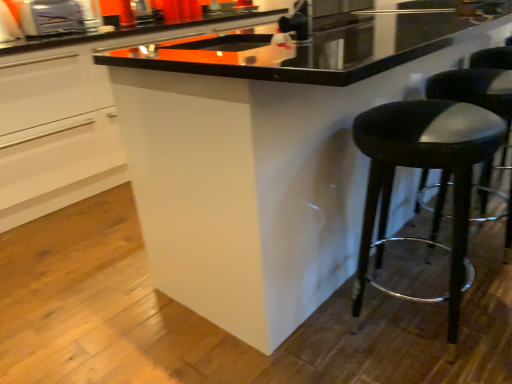
Question: Should I look upward or downward to see black leather stool at lower right?

Choices:
 (A) up
 (B) down

Answer: (B)

Question: Is white glossy cabinet at center wider than black leather stool at right?

Choices:
 (A) no
 (B) yes

Answer: (B)

Question: Are white glossy cabinet at center and black leather stool at right beside each other?

Choices:
 (A) yes
 (B) no

Answer: (B)

Question: From a real-world perspective, is white glossy cabinet at center over black leather stool at right?

Choices:
 (A) no
 (B) yes

Answer: (B)

Question: From a real-world perspective, is white glossy cabinet at center located beneath black leather stool at right?

Choices:
 (A) yes
 (B) no

Answer: (B)

Question: Considering the relative sizes of white glossy cabinet at center and black leather stool at right in the image provided, is white glossy cabinet at center shorter than black leather stool at right?

Choices:
 (A) no
 (B) yes

Answer: (A)

Question: Considering the relative sizes of white glossy cabinet at center and black leather stool at right in the image provided, is white glossy cabinet at center bigger than black leather stool at right?

Choices:
 (A) yes
 (B) no

Answer: (A)

Question: Considering the relative sizes of metallic silver toaster at upper left and black leather stool at right in the image provided, is metallic silver toaster at upper left shorter than black leather stool at right?

Choices:
 (A) no
 (B) yes

Answer: (B)

Question: From the image's perspective, is metallic silver toaster at upper left on top of black leather stool at right?

Choices:
 (A) yes
 (B) no

Answer: (A)

Question: Can you confirm if metallic silver toaster at upper left is smaller than black leather stool at right?

Choices:
 (A) yes
 (B) no

Answer: (A)

Question: Can you confirm if metallic silver toaster at upper left is positioned to the left of black leather stool at right?

Choices:
 (A) no
 (B) yes

Answer: (B)

Question: Is metallic silver toaster at upper left positioned behind black leather stool at right?

Choices:
 (A) yes
 (B) no

Answer: (A)

Question: Is metallic silver toaster at upper left not within black leather stool at right?

Choices:
 (A) no
 (B) yes

Answer: (B)

Question: Does black leather stool at lower right lie in front of metallic silver toaster at upper left?

Choices:
 (A) no
 (B) yes

Answer: (B)